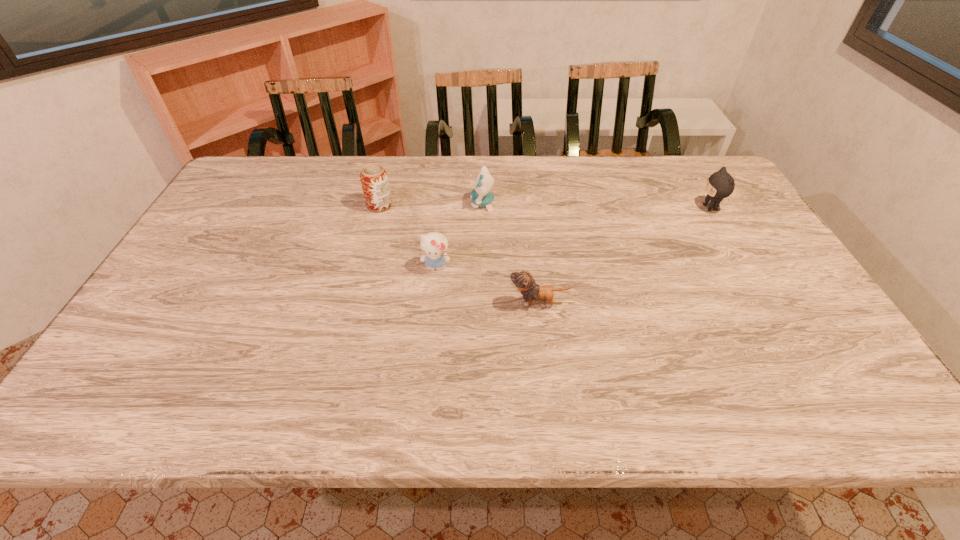
In order to click on vacant area that lies between the rightmost kitten and the nearest object in this screenshot , I will do `click(625, 255)`.

Identify the location of blank region between the second object from left to right and the beer can. Image resolution: width=960 pixels, height=540 pixels. (407, 236).

Image resolution: width=960 pixels, height=540 pixels. Find the location of `vacant space in between the leftmost object and the third object from right to left`. vacant space in between the leftmost object and the third object from right to left is located at coordinates (431, 205).

Find the location of `free spot between the nearest kitten and the beer can`. free spot between the nearest kitten and the beer can is located at coordinates (459, 254).

Where is `free space between the second nearest object and the leftmost object`? This screenshot has width=960, height=540. free space between the second nearest object and the leftmost object is located at coordinates (407, 236).

Identify which object is the third nearest to the rightmost object. Please provide its 2D coordinates. Your answer should be formatted as a tuple, i.e. [(x, y)], where the tuple contains the x and y coordinates of a point satisfying the conditions above.

[(434, 245)]

At what (x,y) coordinates should I click in order to perform the action: click on the second closest object to the rightmost object. Please return your answer as a coordinate pair (x, y). Image resolution: width=960 pixels, height=540 pixels. Looking at the image, I should click on (480, 196).

This screenshot has width=960, height=540. I want to click on the second closest kitten relative to the third object from right to left, so 523,281.

Where is `the second closest kitten relative to the third kitten from right to left`? The width and height of the screenshot is (960, 540). the second closest kitten relative to the third kitten from right to left is located at coordinates (523, 281).

The height and width of the screenshot is (540, 960). Find the location of `vacant space that satisfies the following two spatial constraints: 1. on the face of the third kitten from right to left; 2. on the front-facing side of the second nearest object`. vacant space that satisfies the following two spatial constraints: 1. on the face of the third kitten from right to left; 2. on the front-facing side of the second nearest object is located at coordinates (483, 267).